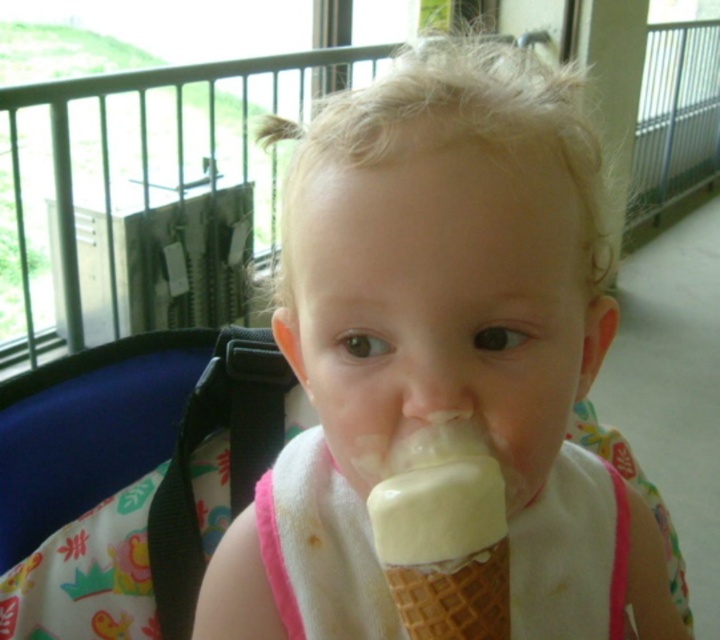
You are a photographer taking a close up shot of a child eating ice cream. You need to ensure the white fabric bib at mouth is in focus. Given that the depth of field at this distance can only sharply focus objects within 15 inches from the camera, will the bib be in focus?

The white fabric bib at mouth is 15.23 inches away from the camera, which exceeds the 15 inch depth of field limit. Therefore, the bib will not be in focus.

You are a photographer taking a picture of the child and the ice cream. You notice two points in the scene marked as point 1 at coordinates (595,291) and point 2 at coordinates (598,580). Which point should you focus on to ensure the child and ice cream are in sharp focus?

You should focus on point 1 at coordinates (595,291) because it is closer to the viewer than point 2 at coordinates (598,580), ensuring the child and ice cream are in sharp focus.

The child is eating ice cream and has both the white fabric bib at mouth and the vanilla ice cream at mouth. Which object is bigger in size?

The white fabric bib at mouth is larger in size compared to the vanilla ice cream at mouth.